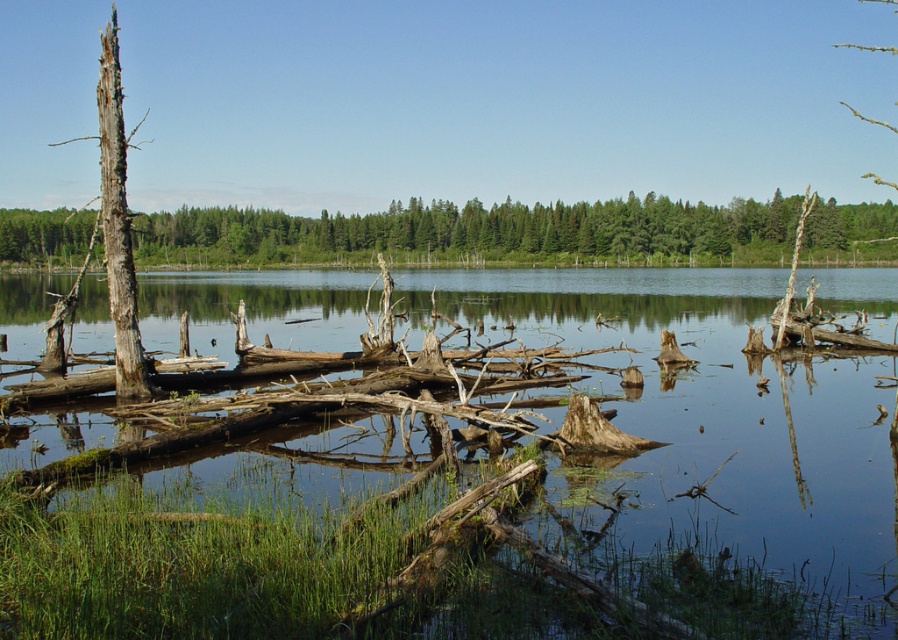
Question: Which point is farther to the camera?

Choices:
 (A) (590, 232)
 (B) (110, 244)

Answer: (A)

Question: Which object is the closest to the dead wood at left?

Choices:
 (A) clear water at center
 (B) brown rough bark tree trunk at left

Answer: (A)

Question: Does clear water at center appear over dead wood at left?

Choices:
 (A) yes
 (B) no

Answer: (B)

Question: Does dead wood at left appear on the left side of brown rough bark tree trunk at left?

Choices:
 (A) yes
 (B) no

Answer: (B)

Question: Which of the following is the closest to the observer?

Choices:
 (A) brown rough bark tree trunk at left
 (B) dead wood at left

Answer: (B)

Question: Can you confirm if clear water at center is wider than brown rough bark tree trunk at left?

Choices:
 (A) no
 (B) yes

Answer: (A)